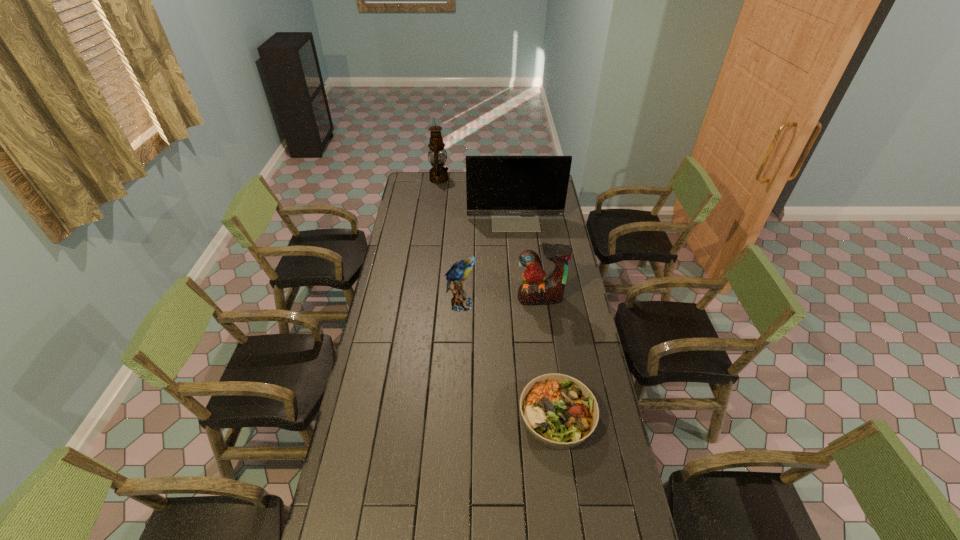
At what (x,y) coordinates should I click in order to perform the action: click on free space at the right edge of the desktop. Please return your answer as a coordinate pair (x, y). The height and width of the screenshot is (540, 960). Looking at the image, I should click on (603, 530).

What are the coordinates of `vacant space that is in between the right parrot and the left parrot` in the screenshot? It's located at (500, 301).

I want to click on vacant space in between the salad plate and the oil lamp, so click(x=498, y=298).

Locate an element on the screen. The width and height of the screenshot is (960, 540). unoccupied area between the leftmost object and the salad plate is located at coordinates (498, 298).

You are a GUI agent. You are given a task and a screenshot of the screen. Output one action in this format:
    pyautogui.click(x=<x>, y=<y>)
    Task: Click on the free spot between the left parrot and the salad plate
    
    Given the screenshot: What is the action you would take?
    pyautogui.click(x=509, y=361)

This screenshot has width=960, height=540. In order to click on empty space between the fourth nearest object and the left parrot in this screenshot , I will do `click(488, 261)`.

At what (x,y) coordinates should I click in order to perform the action: click on object that is the fourth closest to the leftmost object. Please return your answer as a coordinate pair (x, y). This screenshot has width=960, height=540. Looking at the image, I should click on (559, 412).

Identify which object is the fourth closest to the oil lamp. Please provide its 2D coordinates. Your answer should be formatted as a tuple, i.e. [(x, y)], where the tuple contains the x and y coordinates of a point satisfying the conditions above.

[(559, 412)]

I want to click on free point that satisfies the following two spatial constraints: 1. on the face of the left parrot; 2. on the left side of the nearest object, so click(x=456, y=417).

Locate an element on the screen. The image size is (960, 540). free point that satisfies the following two spatial constraints: 1. on the screen of the computer monitor; 2. on the left side of the nearest object is located at coordinates (535, 417).